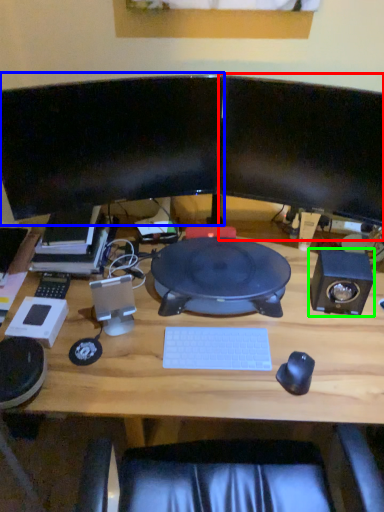
Question: Which object is the closest to the computer monitor (highlighted by a red box)? Choose among these: computer monitor (highlighted by a blue box) or speaker (highlighted by a green box).

Choices:
 (A) computer monitor
 (B) speaker

Answer: (A)